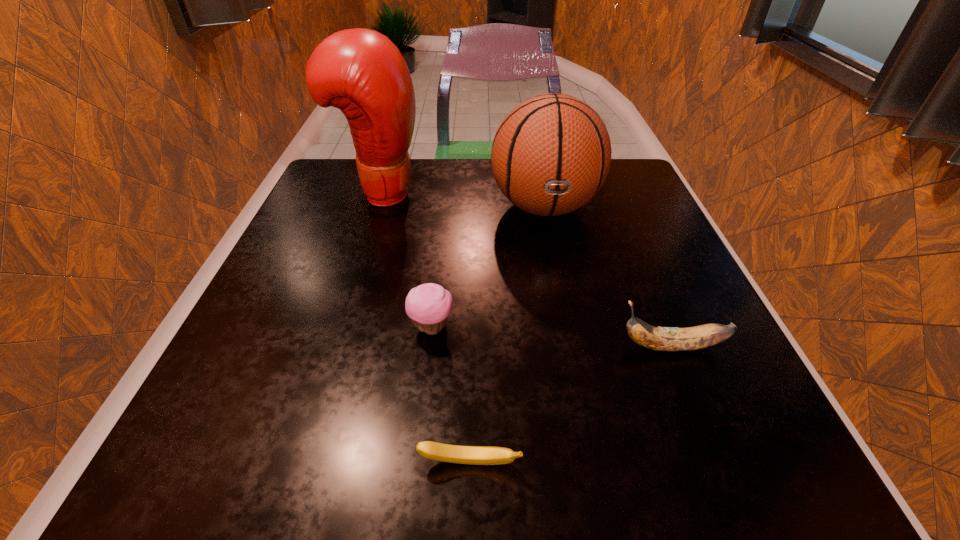
The width and height of the screenshot is (960, 540). I want to click on object positioned at the far left corner, so click(x=360, y=71).

Locate an element on the screen. object located at the far right corner is located at coordinates (551, 154).

In order to click on vacant position at the far edge of the desktop in this screenshot , I will do `click(424, 193)`.

You are a GUI agent. You are given a task and a screenshot of the screen. Output one action in this format:
    pyautogui.click(x=<x>, y=<y>)
    Task: Click on the vacant space at the near edge of the desktop
    This screenshot has width=960, height=540.
    Given the screenshot: What is the action you would take?
    pyautogui.click(x=404, y=463)

You are a GUI agent. You are given a task and a screenshot of the screen. Output one action in this format:
    pyautogui.click(x=<x>, y=<y>)
    Task: Click on the vacant space at the left edge
    Image resolution: width=960 pixels, height=540 pixels.
    Given the screenshot: What is the action you would take?
    pyautogui.click(x=349, y=217)

Where is `free region at the right edge`? This screenshot has width=960, height=540. free region at the right edge is located at coordinates (706, 399).

Identify the location of free space at the near left corner of the desktop. (295, 423).

Locate an element on the screen. The image size is (960, 540). vacant space at the near right corner of the desktop is located at coordinates (774, 480).

Where is `free space between the boxing glove and the right banana`? free space between the boxing glove and the right banana is located at coordinates (526, 269).

Identify the location of free space between the right banana and the leftmost object. This screenshot has width=960, height=540. (526, 269).